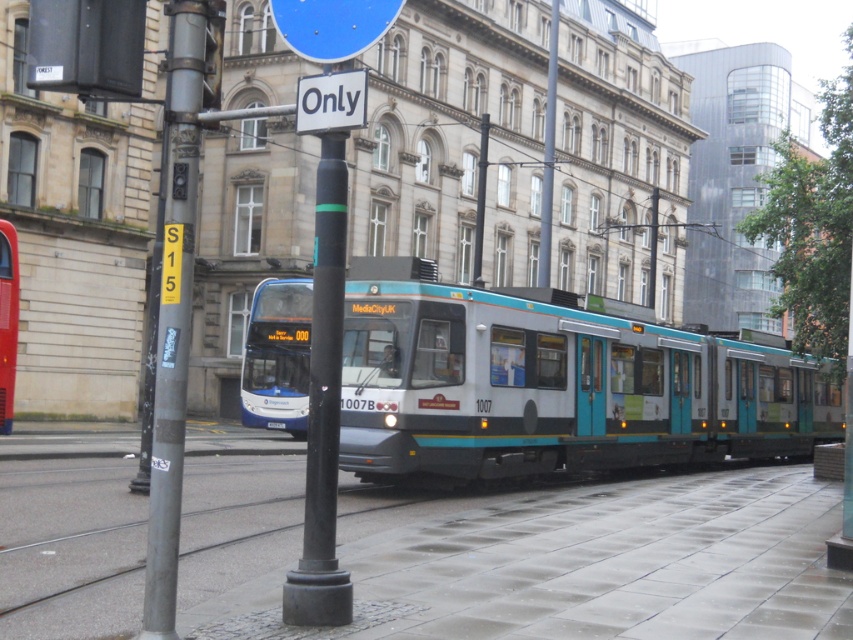
Question: Among these objects, which one is farthest from the camera?

Choices:
 (A) matte blue bus at center
 (B) teal glossy tram at center
 (C) gray concrete pavement at center

Answer: (A)

Question: Does teal glossy tram at center come in front of blue metallic bus at center?

Choices:
 (A) no
 (B) yes

Answer: (B)

Question: Does blue glossy sign at upper center have a greater width compared to white plastic sign at upper center?

Choices:
 (A) yes
 (B) no

Answer: (A)

Question: Which object appears farthest from the camera in this image?

Choices:
 (A) gray concrete pavement at center
 (B) matte blue bus at center

Answer: (B)

Question: From the image, what is the correct spatial relationship of gray concrete pavement at center in relation to blue glossy sign at upper center?

Choices:
 (A) above
 (B) below

Answer: (B)

Question: Which of the following is the closest to the observer?

Choices:
 (A) (260, 349)
 (B) (177, 369)
 (C) (299, 93)

Answer: (B)